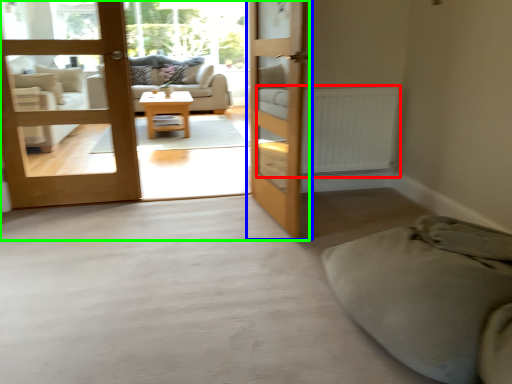
Question: Which object is the farthest from radiator (highlighted by a red box)? Choose among these: door (highlighted by a blue box) or bunk bed (highlighted by a green box).

Choices:
 (A) door
 (B) bunk bed

Answer: (B)